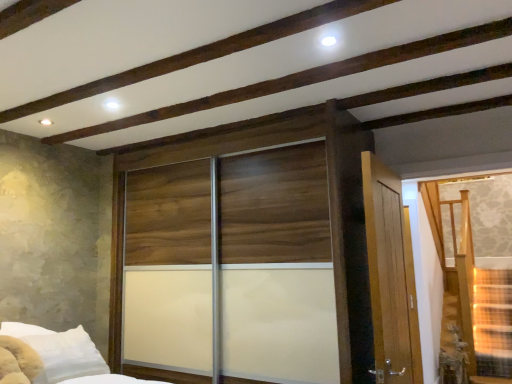
Question: Based on their sizes in the image, would you say translucent glass door at right is bigger or smaller than wooden sliding door at center?

Choices:
 (A) small
 (B) big

Answer: (A)

Question: Is translucent glass door at right situated inside wooden sliding door at center or outside?

Choices:
 (A) outside
 (B) inside

Answer: (A)

Question: From a real-world perspective, is translucent glass door at right physically located above or below wooden sliding door at center?

Choices:
 (A) below
 (B) above

Answer: (A)

Question: Based on their positions, is wooden sliding door at center located to the left or right of translucent glass door at right?

Choices:
 (A) left
 (B) right

Answer: (A)

Question: From the image's perspective, is wooden sliding door at center located above or below translucent glass door at right?

Choices:
 (A) above
 (B) below

Answer: (B)

Question: In terms of size, does wooden sliding door at center appear bigger or smaller than translucent glass door at right?

Choices:
 (A) big
 (B) small

Answer: (A)

Question: From a real-world perspective, is wooden sliding door at center above or below translucent glass door at right?

Choices:
 (A) above
 (B) below

Answer: (A)